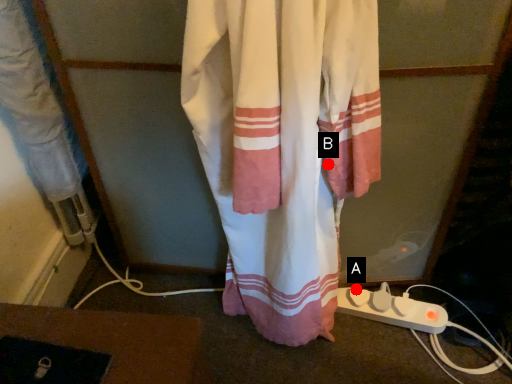
Question: Two points are circled on the image, labeled by A and B beside each circle. Which point appears closest to the camera in this image?

Choices:
 (A) A is closer
 (B) B is closer

Answer: (B)